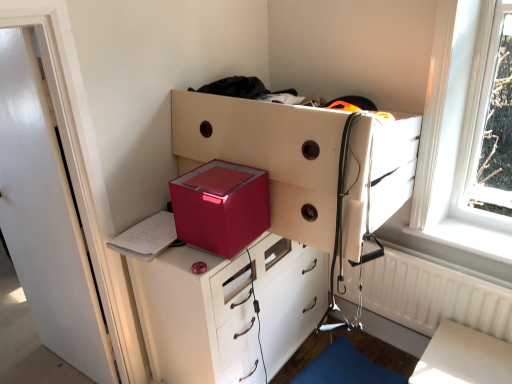
Question: Should I look upward or downward to see metallic red chest of drawers at center, the 2th chest of drawers in the top-to-bottom sequence?

Choices:
 (A) down
 (B) up

Answer: (A)

Question: Is there a large distance between white glossy table at lower right and white textured radiator at right?

Choices:
 (A) no
 (B) yes

Answer: (A)

Question: Is white glossy table at lower right taller than white textured radiator at right?

Choices:
 (A) yes
 (B) no

Answer: (B)

Question: From a real-world perspective, is white glossy table at lower right on white textured radiator at right?

Choices:
 (A) yes
 (B) no

Answer: (B)

Question: Can white textured radiator at right be found inside white glossy table at lower right?

Choices:
 (A) yes
 (B) no

Answer: (B)

Question: From a real-world perspective, is white glossy table at lower right physically below white textured radiator at right?

Choices:
 (A) yes
 (B) no

Answer: (A)

Question: Does white glossy table at lower right have a larger size compared to white textured radiator at right?

Choices:
 (A) yes
 (B) no

Answer: (A)

Question: Is metallic white chest of drawers at center, which appears as the second chest of drawers when ordered from the bottom, at the right side of metallic red chest of drawers at center, the 2th chest of drawers in the top-to-bottom sequence?

Choices:
 (A) yes
 (B) no

Answer: (A)

Question: Is the position of metallic white chest of drawers at center, which is the first chest of drawers in top-to-bottom order, less distant than that of metallic red chest of drawers at center, the first chest of drawers when ordered from bottom to top?

Choices:
 (A) no
 (B) yes

Answer: (B)

Question: Is metallic white chest of drawers at center, which appears as the second chest of drawers when ordered from the bottom, behind metallic red chest of drawers at center, the 2th chest of drawers in the top-to-bottom sequence?

Choices:
 (A) yes
 (B) no

Answer: (B)

Question: Is metallic white chest of drawers at center, which is the first chest of drawers in top-to-bottom order, to the left of metallic red chest of drawers at center, the 2th chest of drawers in the top-to-bottom sequence, from the viewer's perspective?

Choices:
 (A) yes
 (B) no

Answer: (B)

Question: Considering the relative sizes of metallic white chest of drawers at center, which is the first chest of drawers in top-to-bottom order, and metallic red chest of drawers at center, the 2th chest of drawers in the top-to-bottom sequence, in the image provided, is metallic white chest of drawers at center, which is the first chest of drawers in top-to-bottom order, bigger than metallic red chest of drawers at center, the 2th chest of drawers in the top-to-bottom sequence,?

Choices:
 (A) yes
 (B) no

Answer: (B)

Question: Is metallic white chest of drawers at center, which is the first chest of drawers in top-to-bottom order, not within metallic red chest of drawers at center, the 2th chest of drawers in the top-to-bottom sequence?

Choices:
 (A) yes
 (B) no

Answer: (A)

Question: Would you say metallic pink cube at center is a long distance from blue fabric step stool at lower right?

Choices:
 (A) no
 (B) yes

Answer: (A)